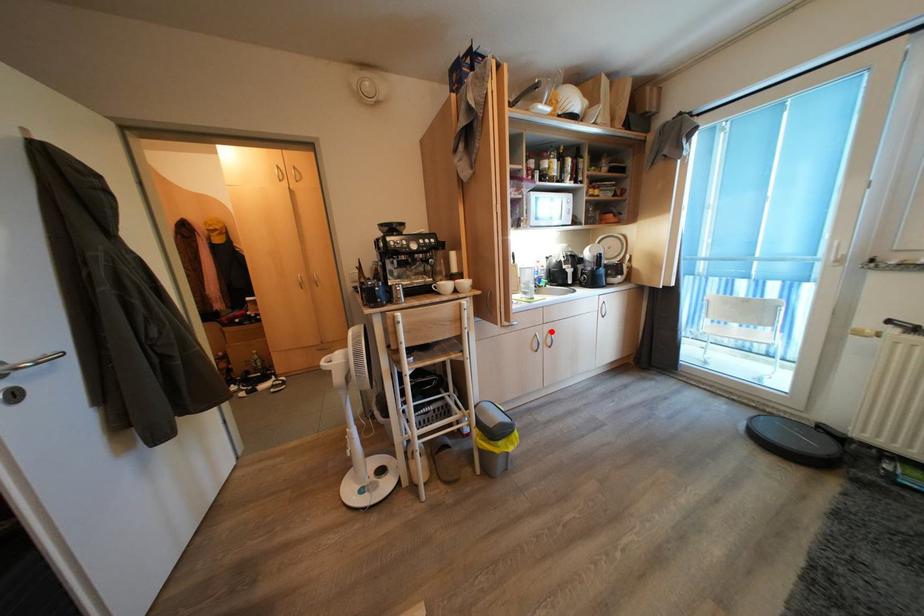
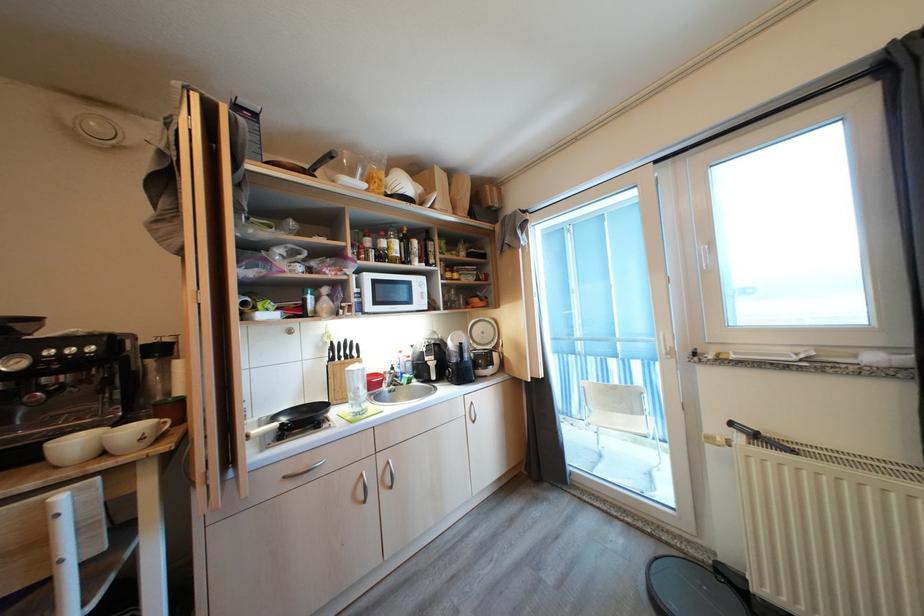
Locate, in the second image, the point that corresponds to the highlighted location in the first image.

(387, 462)